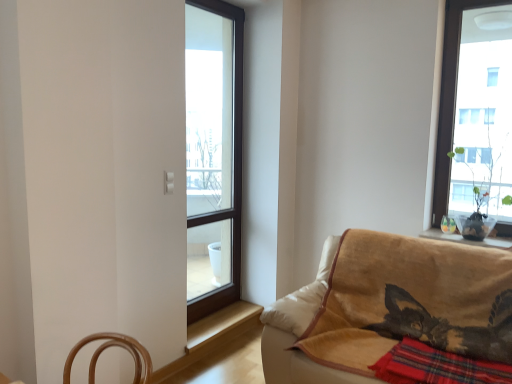
What do you see at coordinates (220, 324) in the screenshot?
I see `wooden at lower center` at bounding box center [220, 324].

Where is `transparent glass window at center`? The image size is (512, 384). transparent glass window at center is located at coordinates (213, 154).

Measure the distance from velvet beige couch at lower right to transparent glass window at center.

The distance of velvet beige couch at lower right from transparent glass window at center is 1.48 meters.

Considering the sizes of objects velvet beige couch at lower right and transparent glass window at center in the image provided, who is wider, velvet beige couch at lower right or transparent glass window at center?

With larger width is velvet beige couch at lower right.

Which of these two, velvet beige couch at lower right or transparent glass window at center, stands taller?

transparent glass window at center.

This screenshot has width=512, height=384. I want to click on studio couch that is on the right side of transparent glass window at center, so click(x=375, y=301).

Image resolution: width=512 pixels, height=384 pixels. Identify the location of plaid in front of the wooden at lower center. (436, 366).

Is point (426, 380) closer or farther from the camera than point (229, 312)?

Point (426, 380) appears to be closer to the viewer than point (229, 312).

Which object is thinner, red plaid blanket at lower right or wooden at lower center?

With smaller width is wooden at lower center.

Is red plaid blanket at lower right with wooden at lower center?

No, red plaid blanket at lower right is not with wooden at lower center.

Which object is more forward, wooden at lower center or velvet beige couch at lower right?

Positioned in front is velvet beige couch at lower right.

Looking at this image, from a real-world perspective, which is physically above, wooden at lower center or velvet beige couch at lower right?

In real-world perspective, velvet beige couch at lower right is above.

Does wooden at lower center turn towards velvet beige couch at lower right?

Yes, wooden at lower center is oriented towards velvet beige couch at lower right.

Is wooden at lower center surrounding velvet beige couch at lower right?

No, wooden at lower center does not contain velvet beige couch at lower right.

Could you tell me if transparent glass window at center is turned towards red plaid blanket at lower right?

Yes.

Can you confirm if transparent glass window at center is smaller than red plaid blanket at lower right?

Actually, transparent glass window at center might be larger than red plaid blanket at lower right.

Is point (234, 134) less distant than point (435, 382)?

That is False.

From the picture: From a real-world perspective, which is physically below, transparent glass window at center or red plaid blanket at lower right?

red plaid blanket at lower right is physically lower.

In the image, is velvet beige couch at lower right positioned in front of or behind red plaid blanket at lower right?

velvet beige couch at lower right is in front of red plaid blanket at lower right.

From the image's perspective, relative to red plaid blanket at lower right, is velvet beige couch at lower right above or below?

Clearly, from the image's perspective, velvet beige couch at lower right is above red plaid blanket at lower right.

Is velvet beige couch at lower right spatially inside red plaid blanket at lower right, or outside of it?

velvet beige couch at lower right is located beyond the bounds of red plaid blanket at lower right.

Is velvet beige couch at lower right at the left side of red plaid blanket at lower right?

Correct, you'll find velvet beige couch at lower right to the left of red plaid blanket at lower right.

Can you confirm if red plaid blanket at lower right is wider than transparent glass window at center?

Yes, red plaid blanket at lower right is wider than transparent glass window at center.

Is red plaid blanket at lower right with transparent glass window at center?

No, red plaid blanket at lower right is not making contact with transparent glass window at center.

Considering the sizes of red plaid blanket at lower right and transparent glass window at center in the image, is red plaid blanket at lower right bigger or smaller than transparent glass window at center?

red plaid blanket at lower right is smaller than transparent glass window at center.

Measure the distance from red plaid blanket at lower right to transparent glass window at center.

6.86 feet.

I want to click on studio couch positioned vertically above the wooden at lower center (from a real-world perspective), so click(375, 301).

Based on the photo, which is less distant, (381, 302) or (231, 315)?

Point (381, 302) appears to be closer to the viewer than point (231, 315).

Is velvet beige couch at lower right next to wooden at lower center?

velvet beige couch at lower right is not next to wooden at lower center, and they're not touching.

Is velvet beige couch at lower right facing away from wooden at lower center?

No, velvet beige couch at lower right is not facing away from wooden at lower center.

Where is `window above the velvet beige couch at lower right (from a real-world perspective)`? The width and height of the screenshot is (512, 384). window above the velvet beige couch at lower right (from a real-world perspective) is located at coordinates (213, 154).

This screenshot has height=384, width=512. What are the coordinates of `plaid in front of the wooden at lower center` in the screenshot? It's located at (436, 366).

Based on the photo, looking at the image, which one is located closer to transparent glass window at center, velvet beige couch at lower right or red plaid blanket at lower right?

velvet beige couch at lower right is closer to transparent glass window at center.

When comparing their distances from red plaid blanket at lower right, does velvet beige couch at lower right or transparent glass window at center seem further?

transparent glass window at center.

From the image, which object appears to be farther from wooden at lower center, transparent glass window at center or red plaid blanket at lower right?

The object further to wooden at lower center is red plaid blanket at lower right.

Based on the photo, from the image, which object appears to be nearer to red plaid blanket at lower right, wooden at lower center or transparent glass window at center?

wooden at lower center is positioned closer to the anchor red plaid blanket at lower right.

Looking at the image, which one is located further to transparent glass window at center, velvet beige couch at lower right or wooden at lower center?

Among the two, velvet beige couch at lower right is located further to transparent glass window at center.

Based on their spatial positions, is wooden at lower center or red plaid blanket at lower right closer to velvet beige couch at lower right?

red plaid blanket at lower right is closer to velvet beige couch at lower right.

Estimate the real-world distances between objects in this image. Which object is closer to velvet beige couch at lower right, transparent glass window at center or wooden at lower center?

wooden at lower center is positioned closer to the anchor velvet beige couch at lower right.

Considering their positions, is red plaid blanket at lower right positioned further to transparent glass window at center than wooden at lower center?

Based on the image, red plaid blanket at lower right appears to be further to transparent glass window at center.

At what (x,y) coordinates should I click in order to perform the action: click on window between velvet beige couch at lower right and wooden at lower center from front to back. Please return your answer as a coordinate pair (x, y). Looking at the image, I should click on click(213, 154).

The image size is (512, 384). Identify the location of plaid positioned between velvet beige couch at lower right and wooden at lower center from near to far. (436, 366).

Locate an element on the screen. plaid between velvet beige couch at lower right and transparent glass window at center along the z-axis is located at coordinates (436, 366).

Where is `window sill between transparent glass window at center and red plaid blanket at lower right`? This screenshot has height=384, width=512. window sill between transparent glass window at center and red plaid blanket at lower right is located at coordinates (220, 324).